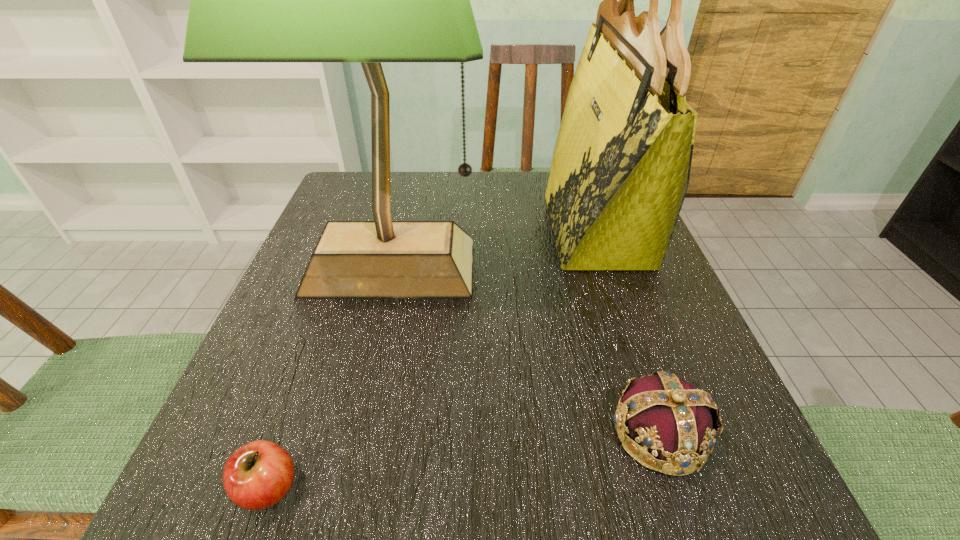
Where is `tote bag`? The height and width of the screenshot is (540, 960). tote bag is located at coordinates (620, 171).

Where is `table lamp`? table lamp is located at coordinates (370, 0).

Locate an element on the screen. The height and width of the screenshot is (540, 960). crown is located at coordinates (678, 423).

At what (x,y) coordinates should I click in order to perform the action: click on the shortest object. Please return your answer as a coordinate pair (x, y). Looking at the image, I should click on (258, 475).

The width and height of the screenshot is (960, 540). What are the coordinates of `vacant space located on the front-facing side of the tote bag` in the screenshot? It's located at (470, 230).

Locate an element on the screen. The width and height of the screenshot is (960, 540). vacant space located on the front-facing side of the tote bag is located at coordinates (520, 230).

You are a GUI agent. You are given a task and a screenshot of the screen. Output one action in this format:
    pyautogui.click(x=<x>, y=<y>)
    Task: Click on the vacant point located 0.390m on the front-facing side of the tote bag
    The image size is (960, 540).
    Given the screenshot: What is the action you would take?
    pyautogui.click(x=376, y=230)

At what (x,y) coordinates should I click in order to perform the action: click on free point located 0.190m on the metallic stand of the table lamp. Please return your answer as a coordinate pair (x, y). Looking at the image, I should click on (355, 416).

You are a GUI agent. You are given a task and a screenshot of the screen. Output one action in this format:
    pyautogui.click(x=<x>, y=<y>)
    Task: Click on the free space located on the back of the crown
    The image size is (960, 540).
    Given the screenshot: What is the action you would take?
    pyautogui.click(x=626, y=332)

Locate an element on the screen. This screenshot has height=540, width=960. blank space located 0.300m on the back of the shortest object is located at coordinates (335, 301).